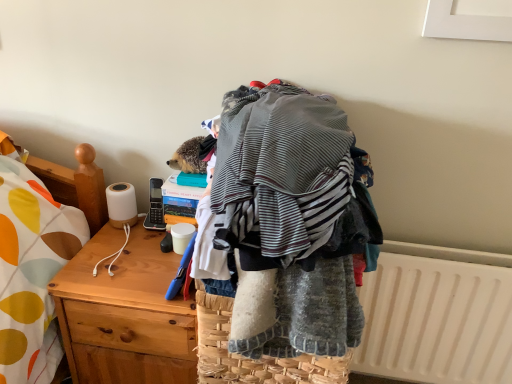
Question: Considering the positions of woven straw picnic basket at center and white plastic radiator at lower right in the image, is woven straw picnic basket at center taller or shorter than white plastic radiator at lower right?

Choices:
 (A) short
 (B) tall

Answer: (A)

Question: Considering the positions of woven straw picnic basket at center and white plastic radiator at lower right in the image, is woven straw picnic basket at center bigger or smaller than white plastic radiator at lower right?

Choices:
 (A) small
 (B) big

Answer: (B)

Question: Which of these objects is positioned closest to the wooden desk at left?

Choices:
 (A) woven straw picnic basket at center
 (B) white plastic radiator at lower right

Answer: (A)

Question: Estimate the real-world distances between objects in this image. Which object is farther from the white plastic radiator at lower right?

Choices:
 (A) woven straw picnic basket at center
 (B) wooden desk at left

Answer: (B)